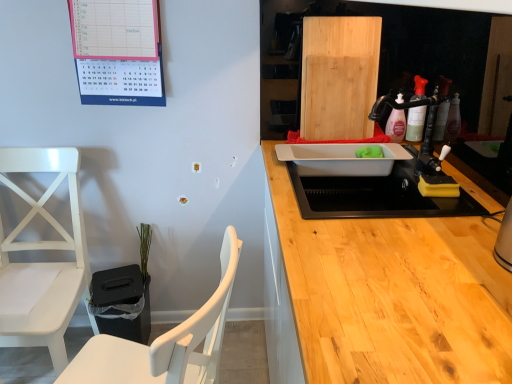
Question: From the image's perspective, is white plastic sink at center, which is counted as the 1th sink, starting from the front, under white plastic sink at center, the second sink positioned from the front?

Choices:
 (A) yes
 (B) no

Answer: (A)

Question: Can you confirm if white plastic sink at center, which is counted as the 1th sink, starting from the front, is shorter than white plastic sink at center, the second sink positioned from the front?

Choices:
 (A) no
 (B) yes

Answer: (A)

Question: Is white plastic sink at center, which is counted as the 1th sink, starting from the front, taller than white plastic sink at center, the 1th sink when ordered from back to front?

Choices:
 (A) yes
 (B) no

Answer: (A)

Question: Is white plastic sink at center, which is counted as the 1th sink, starting from the front, not close to white plastic sink at center, the second sink positioned from the front?

Choices:
 (A) yes
 (B) no

Answer: (B)

Question: Considering the relative positions of white plastic sink at center, the 2th sink from the back, and white plastic sink at center, the 1th sink when ordered from back to front, in the image provided, is white plastic sink at center, the 2th sink from the back, to the left of white plastic sink at center, the 1th sink when ordered from back to front, from the viewer's perspective?

Choices:
 (A) no
 (B) yes

Answer: (A)

Question: Can you confirm if white plastic sink at center, which is counted as the 1th sink, starting from the front, is wider than white plastic sink at center, the 1th sink when ordered from back to front?

Choices:
 (A) yes
 (B) no

Answer: (A)

Question: Is green matte plant at lower left aimed at white plastic sink at center, the second sink positioned from the front?

Choices:
 (A) yes
 (B) no

Answer: (B)

Question: Does green matte plant at lower left have a greater height compared to white plastic sink at center, the second sink positioned from the front?

Choices:
 (A) yes
 (B) no

Answer: (A)

Question: Is green matte plant at lower left smaller than white plastic sink at center, the second sink positioned from the front?

Choices:
 (A) no
 (B) yes

Answer: (B)

Question: Is green matte plant at lower left thinner than white plastic sink at center, the second sink positioned from the front?

Choices:
 (A) no
 (B) yes

Answer: (B)

Question: Can you confirm if green matte plant at lower left is bigger than white plastic sink at center, the second sink positioned from the front?

Choices:
 (A) no
 (B) yes

Answer: (A)

Question: Is green matte plant at lower left wider than white plastic sink at center, the second sink positioned from the front?

Choices:
 (A) yes
 (B) no

Answer: (B)

Question: From a real-world perspective, is white wood chair at left, which ranks as the 2th chair in left-to-right order, physically below pink paper calendar at upper left?

Choices:
 (A) yes
 (B) no

Answer: (A)